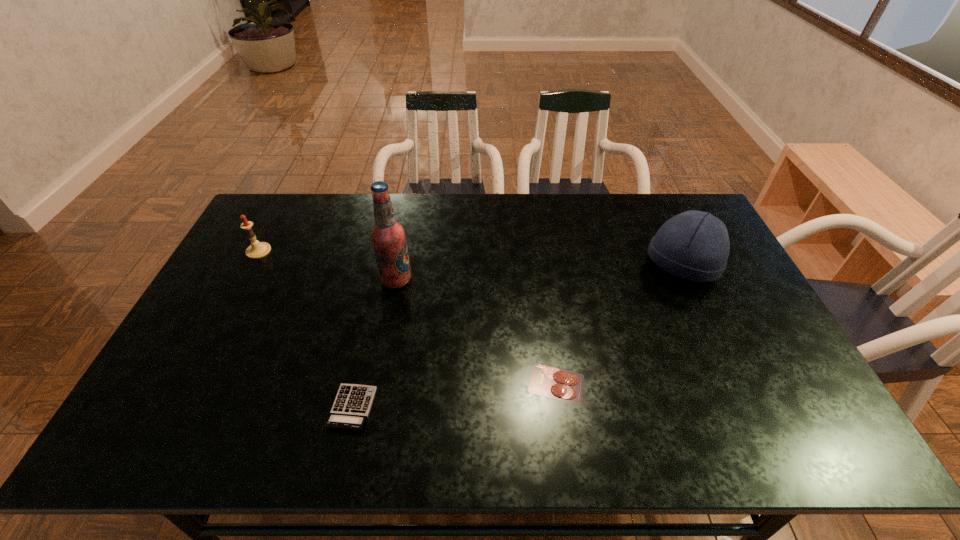
This screenshot has height=540, width=960. Identify the location of the tallest object. (388, 236).

This screenshot has width=960, height=540. Find the location of `the rightmost object`. the rightmost object is located at coordinates (694, 245).

I want to click on the fourth shortest object, so click(694, 245).

Find the location of `the third tallest object`. the third tallest object is located at coordinates (256, 250).

This screenshot has height=540, width=960. In order to click on the leftmost object in this screenshot , I will do `click(256, 250)`.

Find the location of a particular element. calculator is located at coordinates click(351, 407).

Locate an element on the screen. the second object from right to left is located at coordinates (546, 381).

The image size is (960, 540). I want to click on the shortest object, so click(x=546, y=381).

Find the location of a particular element. This screenshot has height=540, width=960. vacant space positioned on the back of the tallest object is located at coordinates (404, 238).

The image size is (960, 540). I want to click on free spot located 0.310m on the left of the second tallest object, so click(x=548, y=266).